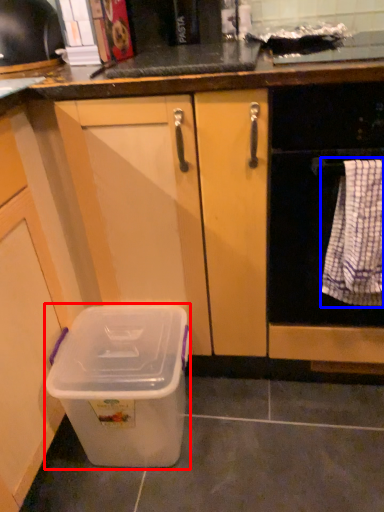
Question: Among these objects, which one is nearest to the camera, storage box (highlighted by a red box) or blanket (highlighted by a blue box)?

Choices:
 (A) storage box
 (B) blanket

Answer: (B)